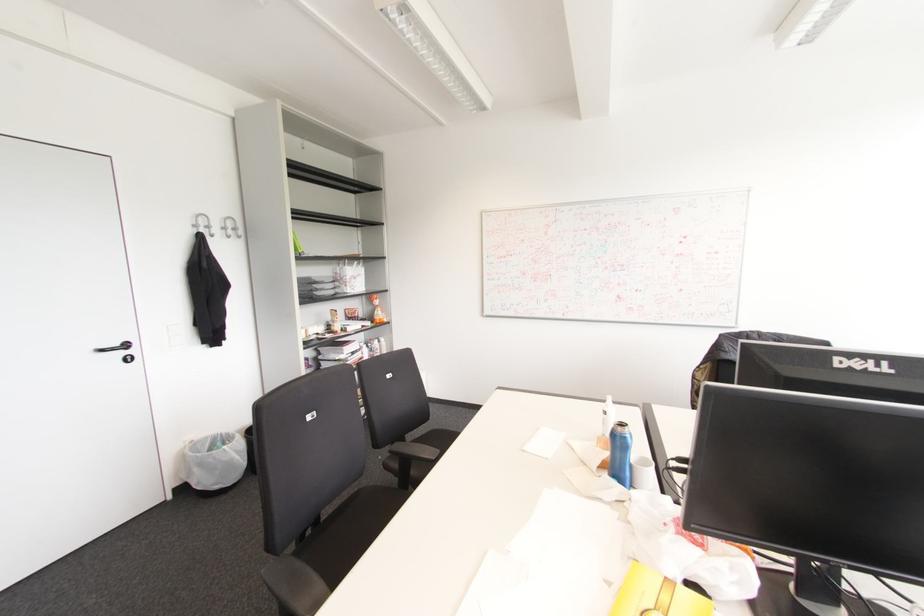
Where would you unscrew the blue water bottle? Please return your answer as a coordinate pair (x, y).

(619, 454)